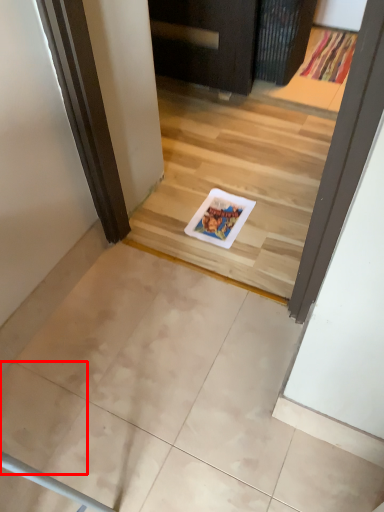
Question: Where is ceramic tile (annotated by the red box) located in relation to doormat in the image?

Choices:
 (A) right
 (B) left

Answer: (B)